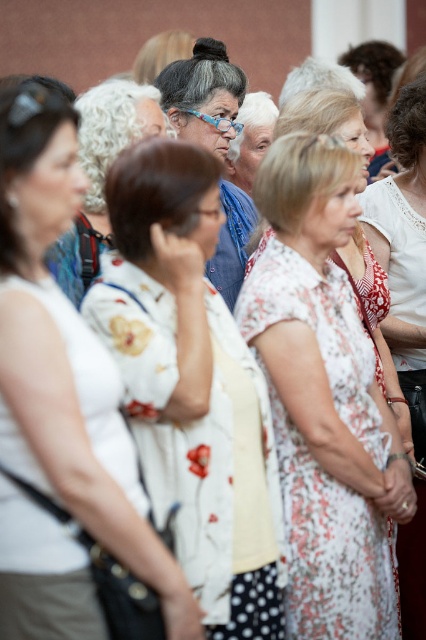
Question: Which point appears farthest from the camera in this image?

Choices:
 (A) (209, 132)
 (B) (25, 330)
 (C) (376, 616)
 (D) (212, 205)

Answer: (A)

Question: Is floral fabric dress at center below floral dress at center?

Choices:
 (A) yes
 (B) no

Answer: (B)

Question: Which object is farther from the camera taking this photo?

Choices:
 (A) white floral dress at center
 (B) floral fabric dress at center

Answer: (B)

Question: Which point is closer to the camera?

Choices:
 (A) (37, 508)
 (B) (233, 388)

Answer: (A)

Question: Does floral dress at center have a smaller size compared to matte blue glasses at center?

Choices:
 (A) no
 (B) yes

Answer: (B)

Question: Is floral dress at center to the left of matte blue glasses at center from the viewer's perspective?

Choices:
 (A) no
 (B) yes

Answer: (A)